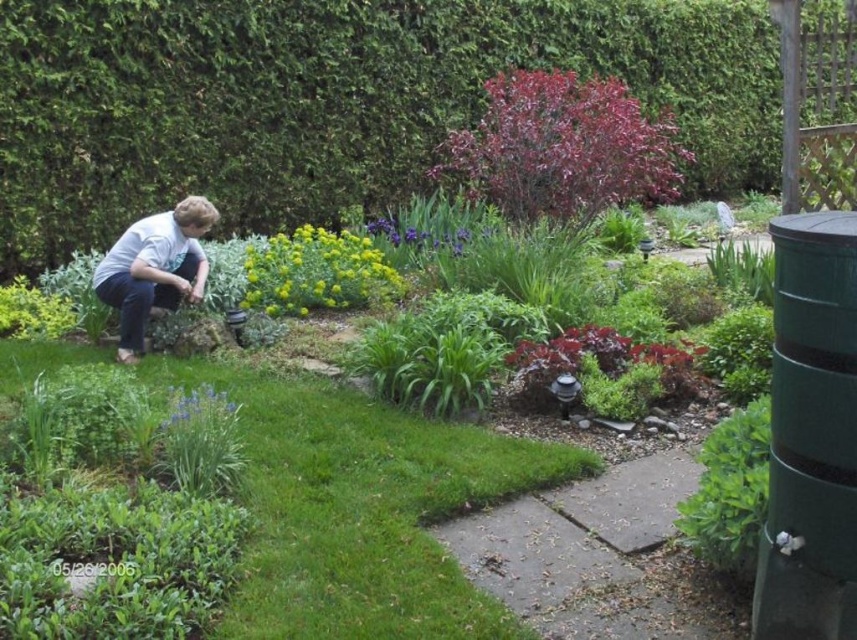
Can you confirm if purple glossy shrub at upper center is taller than blue matte flower at lower center?

Indeed, purple glossy shrub at upper center has a greater height compared to blue matte flower at lower center.

Can you confirm if purple glossy shrub at upper center is positioned below blue matte flower at lower center?

No.

Is point (544, 131) closer to viewer compared to point (190, 397)?

No, it is not.

This screenshot has height=640, width=857. Identify the location of purple glossy shrub at upper center. (562, 148).

Is point (301, 257) positioned in front of point (220, 413)?

That is False.

Which is in front, point (349, 275) or point (186, 401)?

Point (186, 401) is in front.

You are a GUI agent. You are given a task and a screenshot of the screen. Output one action in this format:
    pyautogui.click(x=<x>, y=<y>)
    Task: Click on the green leafy bush at center
    The height and width of the screenshot is (640, 857).
    Given the screenshot: What is the action you would take?
    pyautogui.click(x=316, y=273)

Does glossy red leaves at center have a smaller size compared to purple matte flower at center?

Correct, glossy red leaves at center occupies less space than purple matte flower at center.

Is point (691, 342) closer to viewer compared to point (391, 218)?

Yes.

At what (x,y) coordinates should I click in order to perform the action: click on glossy red leaves at center. Please return your answer as a coordinate pair (x, y). The height and width of the screenshot is (640, 857). Looking at the image, I should click on (597, 353).